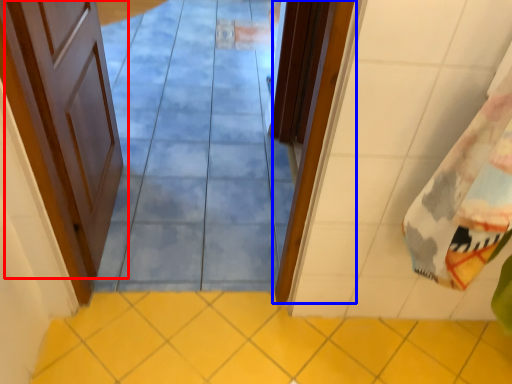
Question: Which object appears farthest to the camera in this image, door (highlighted by a red box) or door (highlighted by a blue box)?

Choices:
 (A) door
 (B) door

Answer: (B)